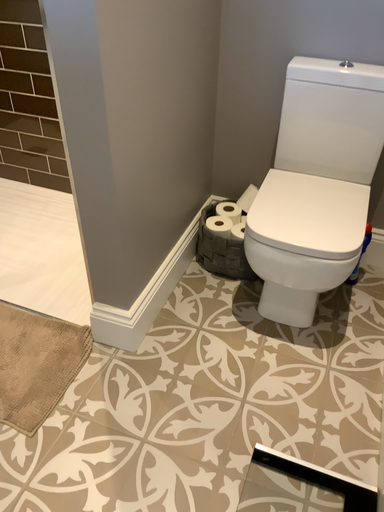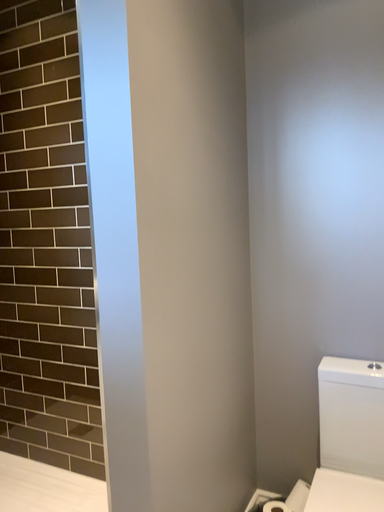
Question: How did the camera likely rotate when shooting the video?

Choices:
 (A) rotated upward
 (B) rotated downward

Answer: (A)